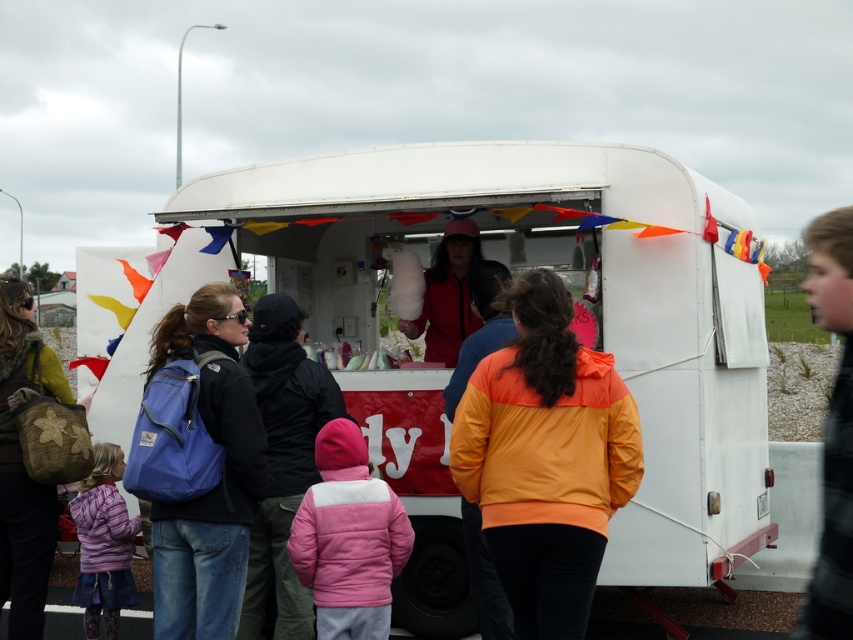
Question: Based on their relative distances, which object is farther from the red matte cotton candy at center?

Choices:
 (A) blue fabric backpack at left
 (B) white matte food truck at center

Answer: (A)

Question: In this image, where is purple fleece jacket at lower left located relative to red matte cotton candy at center?

Choices:
 (A) below
 (B) above

Answer: (A)

Question: Which object appears farthest from the camera in this image?

Choices:
 (A) blue fabric backpack at left
 (B) red matte cotton candy at center

Answer: (B)

Question: Does green textured backpack at left have a greater width compared to red matte cotton candy at center?

Choices:
 (A) yes
 (B) no

Answer: (B)

Question: Among these points, which one is farthest from the camera?

Choices:
 (A) (143, 397)
 (B) (328, 508)
 (C) (457, 269)
 (D) (630, 156)

Answer: (C)

Question: Does pink fleece jacket at center have a larger size compared to pink fleece jacket at lower center?

Choices:
 (A) yes
 (B) no

Answer: (A)